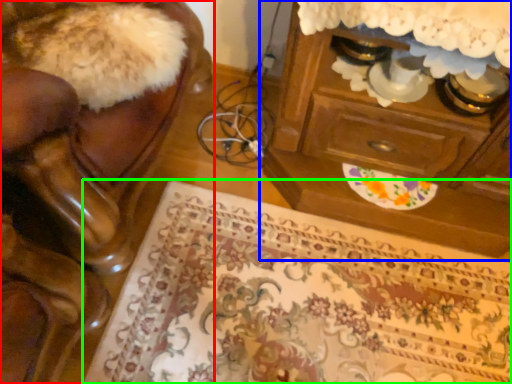
Question: Which is nearer to the furniture (highlighted by a red box)? chest of drawers (highlighted by a blue box) or mat (highlighted by a green box).

Choices:
 (A) chest of drawers
 (B) mat

Answer: (B)